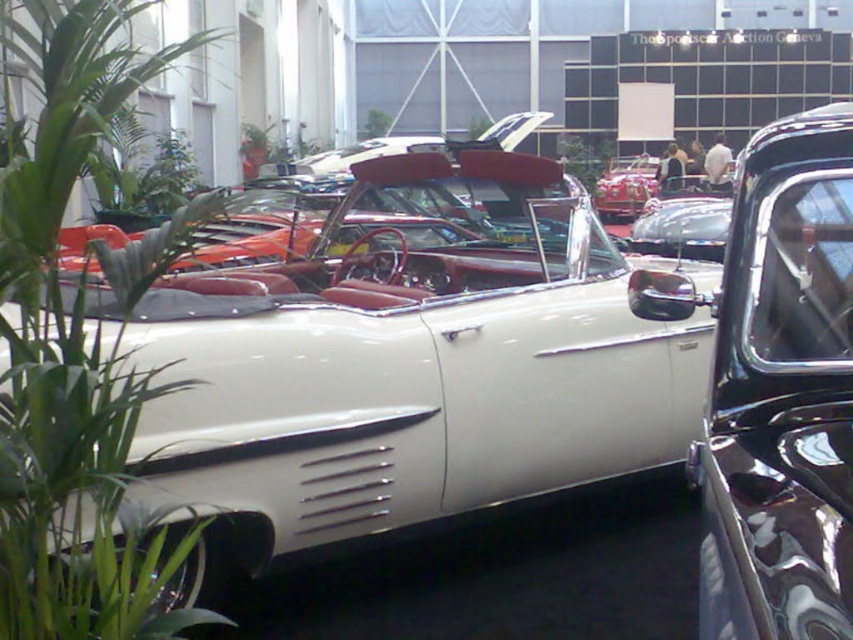
Find the location of a particular element. green leafy plant at left is located at coordinates (78, 348).

Does green leafy plant at left appear on the left side of glossy black car at center?

Correct, you'll find green leafy plant at left to the left of glossy black car at center.

Where is `green leafy plant at left`? green leafy plant at left is located at coordinates (78, 348).